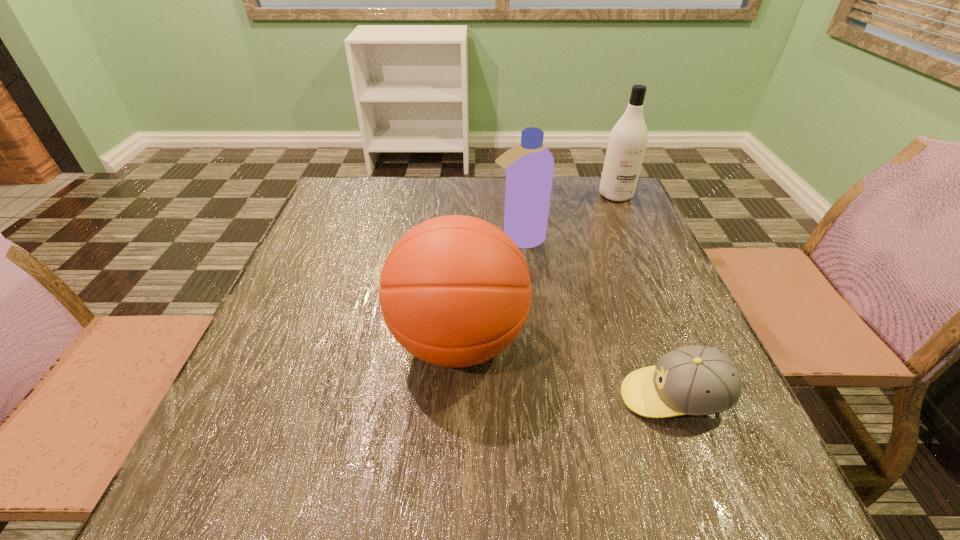
Identify the location of free space located 0.080m on the front-facing side of the shortest object. The image size is (960, 540). (575, 397).

The width and height of the screenshot is (960, 540). Identify the location of free region located on the front-facing side of the shortest object. (499, 397).

Locate an element on the screen. object located in the far edge section of the desktop is located at coordinates (628, 139).

Locate an element on the screen. This screenshot has width=960, height=540. shampoo positioned at the right edge is located at coordinates (628, 139).

Locate an element on the screen. baseball cap located at the right edge is located at coordinates [695, 380].

Find the location of a particular element. The image size is (960, 540). object at the far right corner is located at coordinates (628, 139).

At what (x,y) coordinates should I click in order to perform the action: click on vacant region at the far edge of the desktop. Please return your answer as a coordinate pair (x, y). The width and height of the screenshot is (960, 540). Looking at the image, I should click on (437, 180).

In the image, there is a desktop. Where is `vacant space at the near edge`? The height and width of the screenshot is (540, 960). vacant space at the near edge is located at coordinates (586, 467).

In the image, there is a desktop. In order to click on vacant space at the left edge in this screenshot , I will do `click(240, 439)`.

Find the location of a particular element. The image size is (960, 540). vacant region at the far left corner is located at coordinates (366, 177).